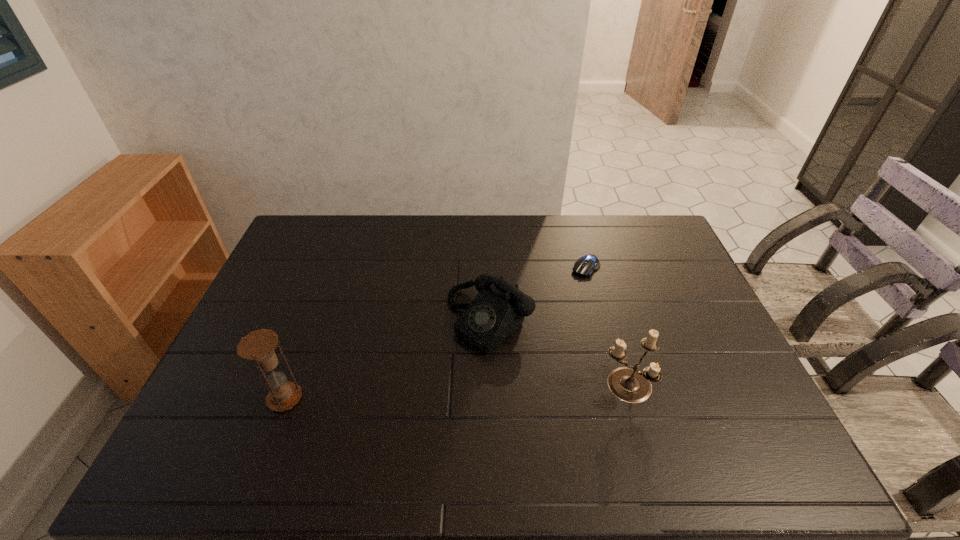
Locate an element on the screen. This screenshot has width=960, height=540. the tallest object is located at coordinates (259, 345).

Locate an element on the screen. The image size is (960, 540). the leftmost object is located at coordinates (259, 345).

You are a GUI agent. You are given a task and a screenshot of the screen. Output one action in this format:
    pyautogui.click(x=<x>, y=<y>)
    Task: Click on the third shortest object
    The width and height of the screenshot is (960, 540).
    Given the screenshot: What is the action you would take?
    pyautogui.click(x=627, y=383)

Locate an element on the screen. the farthest object is located at coordinates (584, 266).

Where is `computer mouse`? computer mouse is located at coordinates (584, 266).

Where is `the third object from right to left`? the third object from right to left is located at coordinates (499, 309).

You are a GUI agent. You are given a task and a screenshot of the screen. Output one action in this format:
    pyautogui.click(x=<x>, y=<y>)
    Task: Click on the third nearest object
    The width and height of the screenshot is (960, 540).
    Given the screenshot: What is the action you would take?
    pyautogui.click(x=499, y=309)

This screenshot has height=540, width=960. What are the coordinates of `vacant area located 0.060m on the back of the tallest object` in the screenshot? It's located at (298, 364).

What are the coordinates of `free region located 0.130m on the back of the third shortest object` in the screenshot? It's located at (611, 329).

Identify the location of vacant position located on the button side of the computer mouse. The image size is (960, 540). (545, 312).